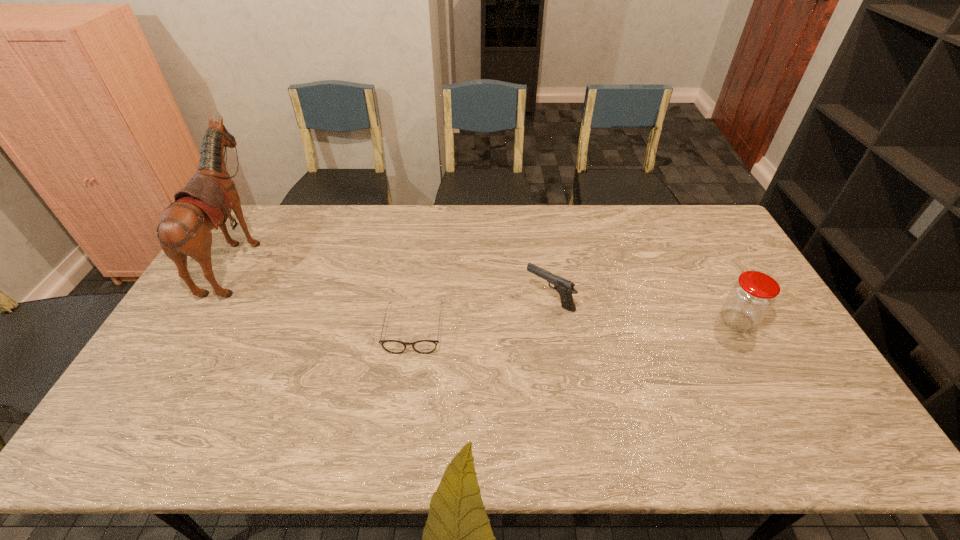
The width and height of the screenshot is (960, 540). Identify the location of vacant space that is in between the saddle and the jar. (489, 288).

Locate an element on the screen. vacant space that's between the rightmost object and the third object from left to right is located at coordinates (643, 310).

Locate an element on the screen. The width and height of the screenshot is (960, 540). object identified as the second closest to the saddle is located at coordinates (565, 288).

Select which object is the second closest to the gun. Please provide its 2D coordinates. Your answer should be formatted as a tuple, i.e. [(x, y)], where the tuple contains the x and y coordinates of a point satisfying the conditions above.

[(751, 297)]

The height and width of the screenshot is (540, 960). What are the coordinates of `vacant position in the image that satisfies the following two spatial constraints: 1. at the muzzle of the third object from left to right; 2. on the back side of the rightmost object` in the screenshot? It's located at (553, 321).

At what (x,y) coordinates should I click in order to perform the action: click on blank space that satisfies the following two spatial constraints: 1. at the muzzle of the gun; 2. on the back side of the rightmost object. Please return your answer as a coordinate pair (x, y). Image resolution: width=960 pixels, height=540 pixels. Looking at the image, I should click on (553, 321).

You are a GUI agent. You are given a task and a screenshot of the screen. Output one action in this format:
    pyautogui.click(x=<x>, y=<y>)
    Task: Click on the vacant space that satisfies the following two spatial constraints: 1. on the back of the leftmost object; 2. on the back side of the rightmost object
    This screenshot has height=540, width=960.
    Given the screenshot: What is the action you would take?
    pyautogui.click(x=201, y=321)

Where is `free spot that satisfies the following two spatial constraints: 1. at the muzzle of the gun; 2. on the right side of the third shortest object`? free spot that satisfies the following two spatial constraints: 1. at the muzzle of the gun; 2. on the right side of the third shortest object is located at coordinates (553, 321).

Where is `free location that satisfies the following two spatial constraints: 1. at the muzzle of the gun; 2. on the right side of the rightmost object`? The image size is (960, 540). free location that satisfies the following two spatial constraints: 1. at the muzzle of the gun; 2. on the right side of the rightmost object is located at coordinates (553, 321).

Image resolution: width=960 pixels, height=540 pixels. In order to click on vacant space that satisfies the following two spatial constraints: 1. on the back of the tallest object; 2. on the left side of the third shortest object in this screenshot , I will do `click(201, 321)`.